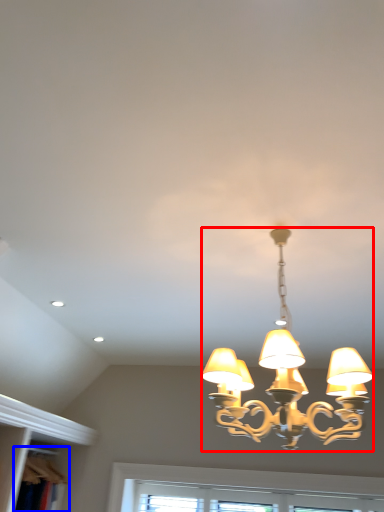
Question: Which object is closer to the camera taking this photo, lamp (highlighted by a red box) or bookshelf (highlighted by a blue box)?

Choices:
 (A) lamp
 (B) bookshelf

Answer: (A)